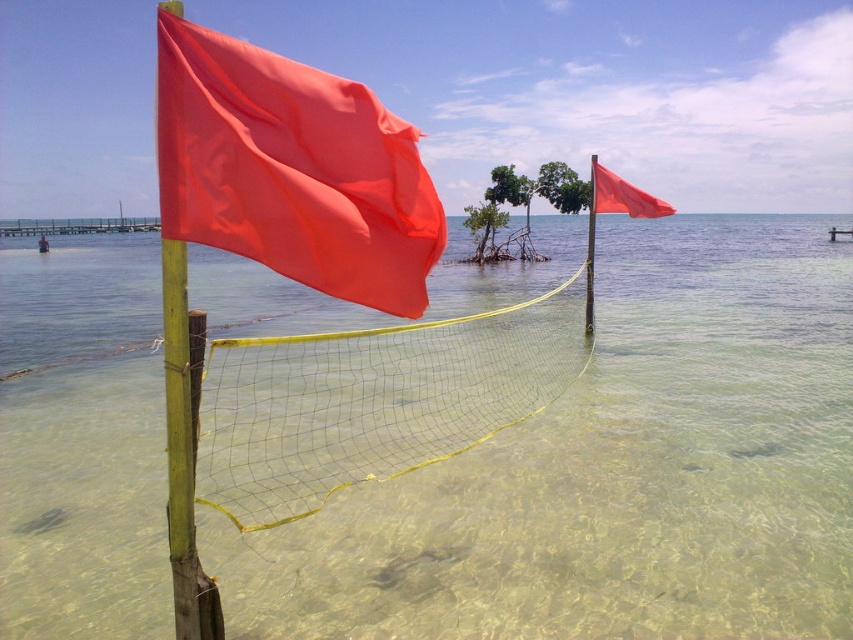
Question: Which point is closer to the camera taking this photo?

Choices:
 (A) (364, 88)
 (B) (106, 564)

Answer: (A)

Question: Does yellow mesh net at center have a larger size compared to matte orange flag at upper right?

Choices:
 (A) no
 (B) yes

Answer: (B)

Question: Based on their relative distances, which object is nearer to the matte fabric flag at center?

Choices:
 (A) yellow mesh net at center
 (B) clear water at center
 (C) matte orange flag at upper right

Answer: (A)

Question: Considering the relative positions of clear water at center and yellow mesh net at center in the image provided, where is clear water at center located with respect to yellow mesh net at center?

Choices:
 (A) left
 (B) right

Answer: (A)

Question: Among these objects, which one is farthest from the camera?

Choices:
 (A) clear water at center
 (B) yellow mesh net at center

Answer: (B)

Question: Does clear water at center appear over yellow mesh net at center?

Choices:
 (A) yes
 (B) no

Answer: (A)